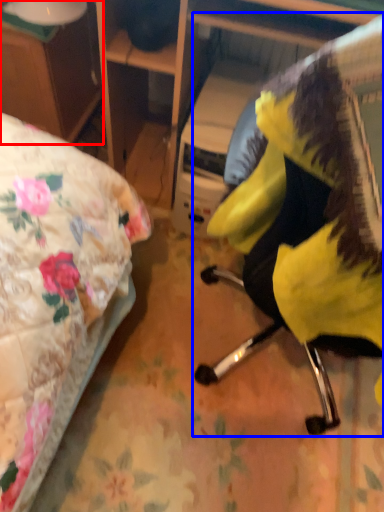
Question: Which object appears closest to the camera in this image, desk (highlighted by a red box) or chair (highlighted by a blue box)?

Choices:
 (A) desk
 (B) chair

Answer: (B)